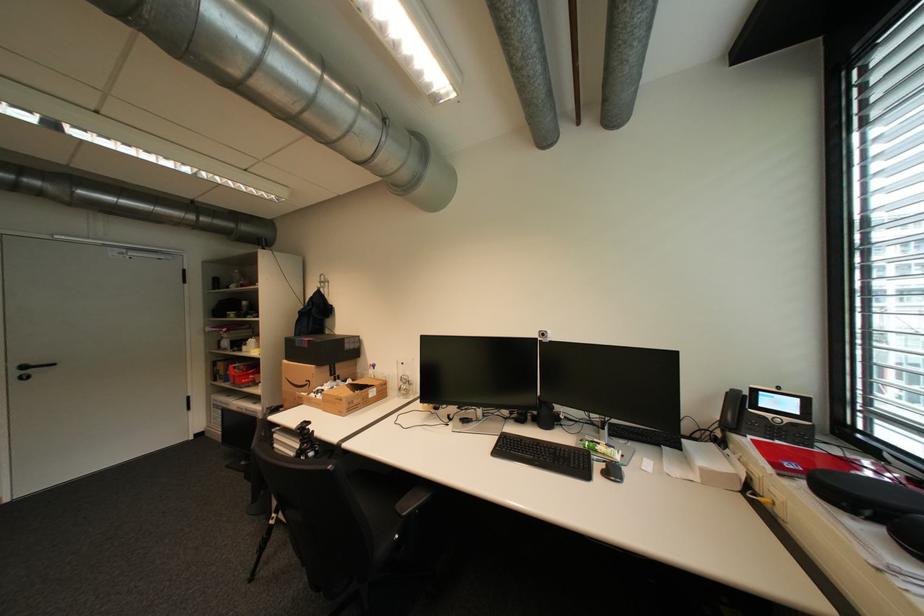
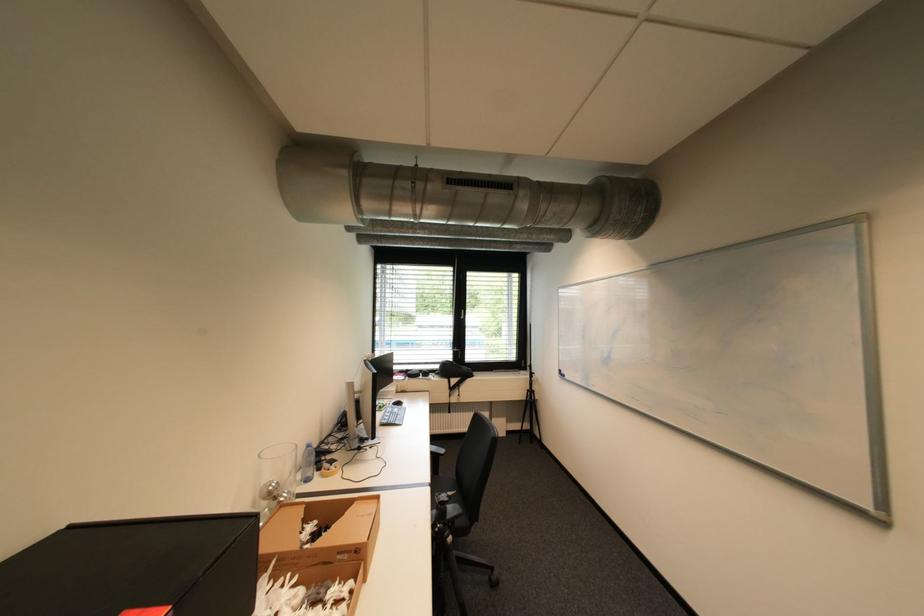
Question: I am providing you with two images of the same scene from different viewpoints. After the viewpoint changes to image2, which objects are now occluded?

Choices:
 (A) black phone handset
 (B) chair sitting surface
 (C) black chair armrest
 (D) shower mixer handle

Answer: (A)